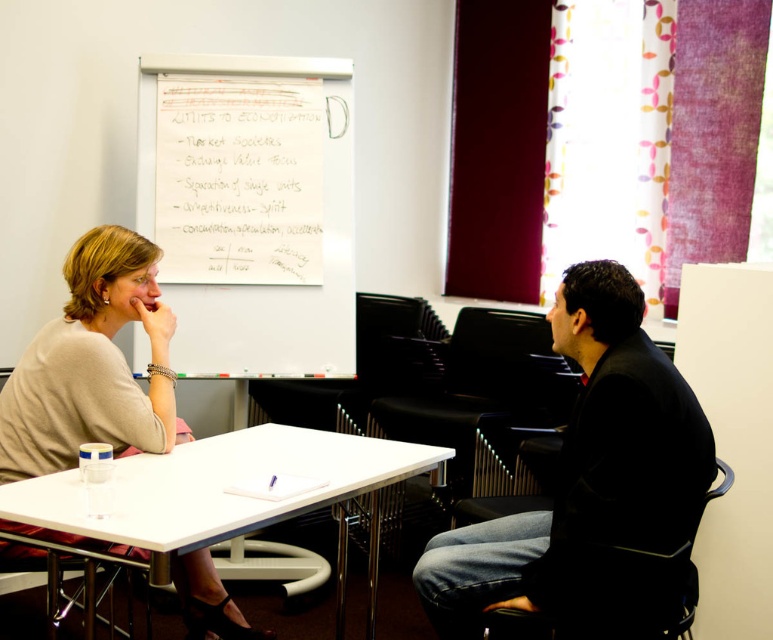
Is white plastic table at center below whiteboard at upper center?

Indeed, white plastic table at center is positioned under whiteboard at upper center.

Is white plastic table at center bigger than whiteboard at upper center?

Incorrect, white plastic table at center is not larger than whiteboard at upper center.

Identify the location of white plastic table at center. (220, 484).

Which of these two, white handwritten notes at upper center or white plastic table at center, stands shorter?

With less height is white plastic table at center.

Between white handwritten notes at upper center and white plastic table at center, which one is positioned higher?

white handwritten notes at upper center is higher up.

At what (x,y) coordinates should I click in order to perform the action: click on white handwritten notes at upper center. Please return your answer as a coordinate pair (x, y). This screenshot has height=640, width=773. Looking at the image, I should click on (237, 179).

This screenshot has height=640, width=773. Describe the element at coordinates (92, 364) in the screenshot. I see `light beige sweater at center` at that location.

Who is taller, light beige sweater at center or whiteboard at upper center?

whiteboard at upper center is taller.

This screenshot has width=773, height=640. What do you see at coordinates (92, 364) in the screenshot?
I see `light beige sweater at center` at bounding box center [92, 364].

This screenshot has width=773, height=640. Identify the location of light beige sweater at center. (92, 364).